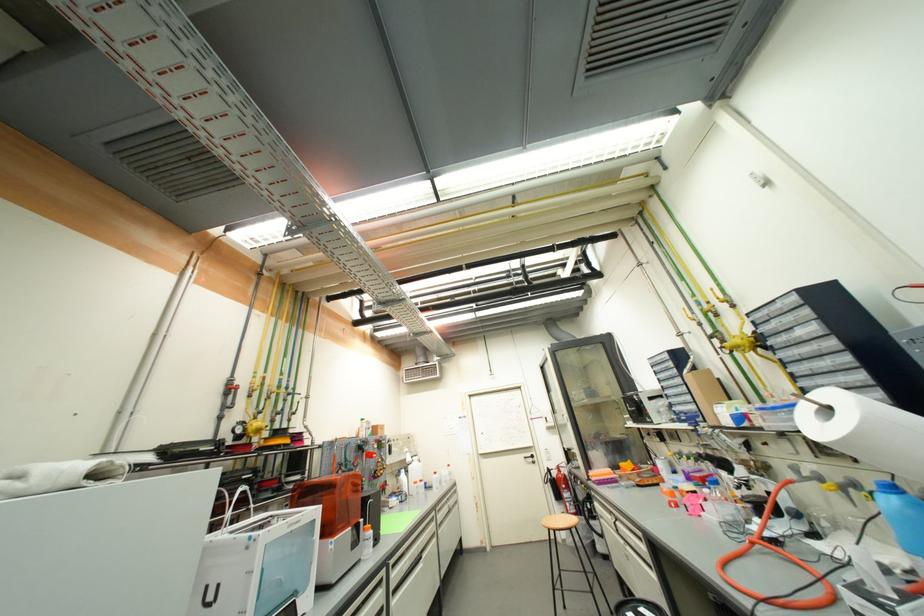
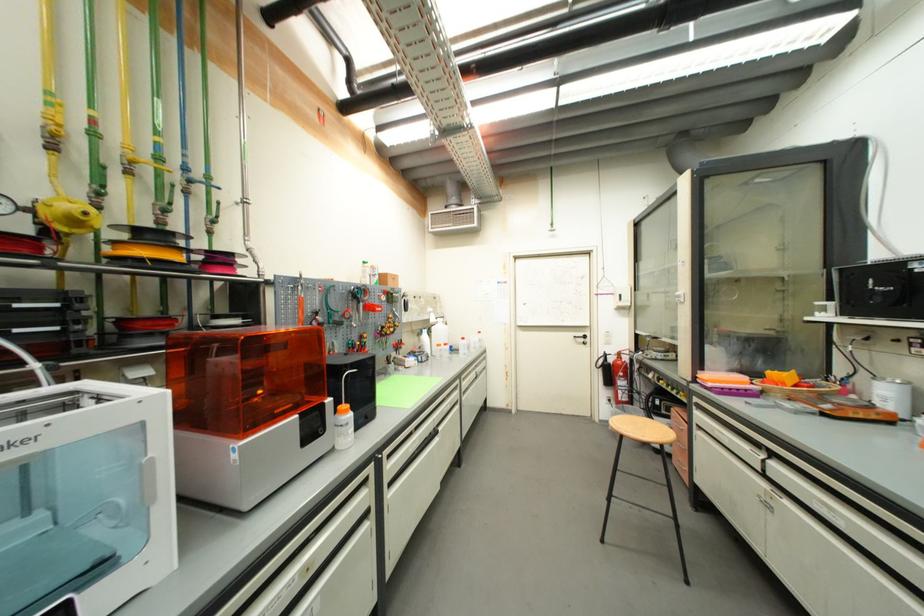
Where in the second image is the point corresponding to (367,522) from the first image?

(334, 402)